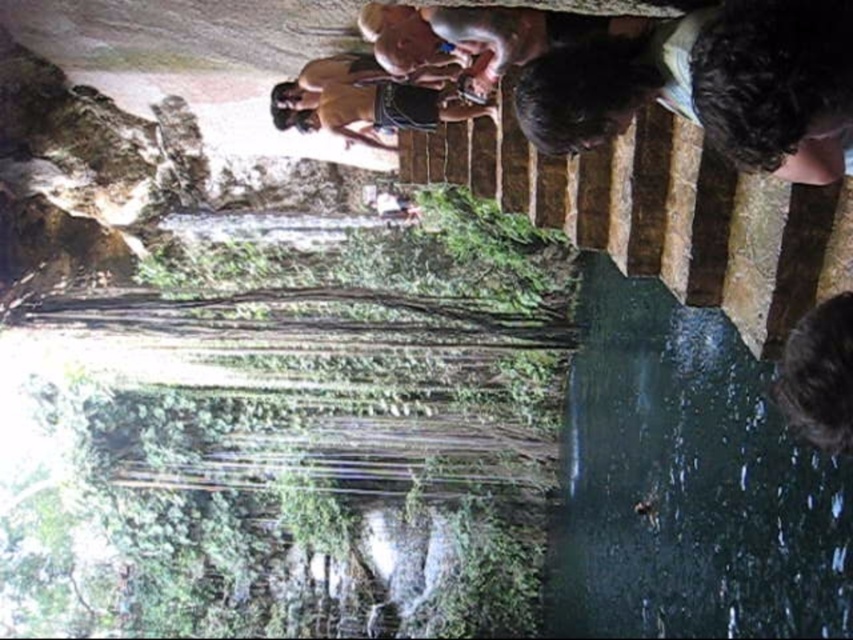
You are standing at the edge of the cenote and want to walk down the steps. You notice two points marked on the steps. Which point, point [781,548] or point [788,88], is closer to you as you stand at the edge?

Point [781,548] is closer to you because it is further to the viewer compared to point [788,88].

Based on the photo, you are standing at the top of the steps leading down into the cenote. You notice two people in the scene. One has dark curly hair at upper center and the other has dark brown hair at lower right. From your vantage point, which person appears closer to you?

The dark curly hair at upper center appears closer because it is positioned in front of the dark brown hair at lower right from your viewpoint.